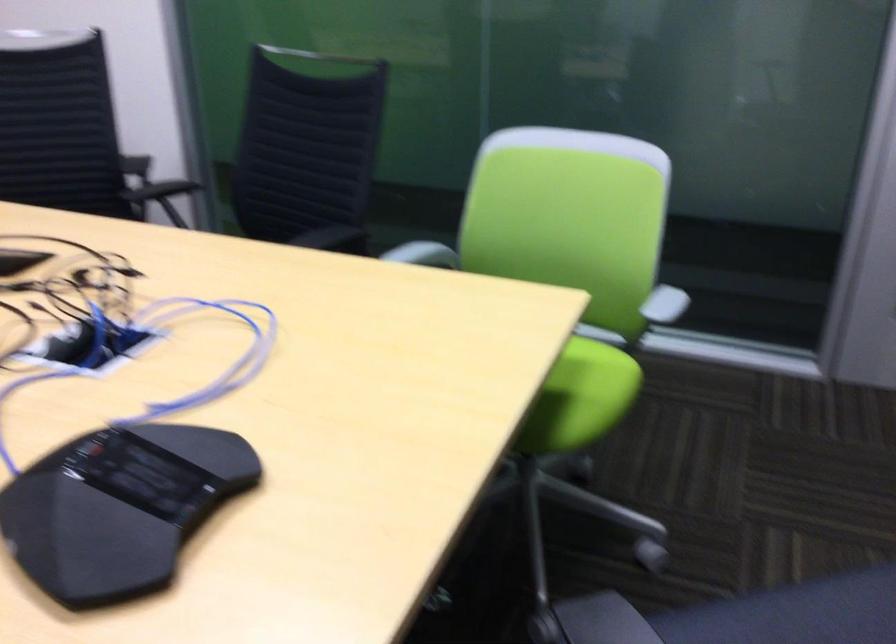
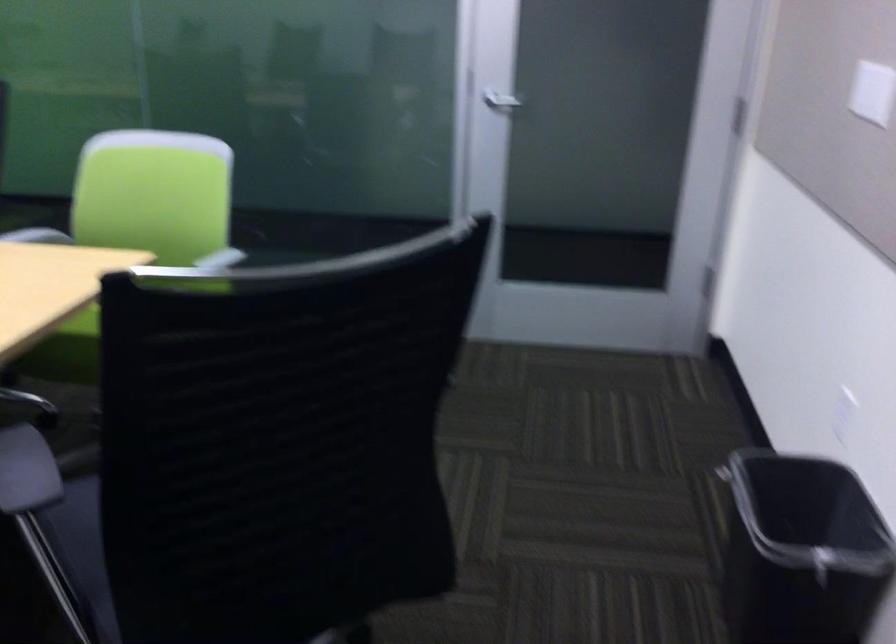
Question: Based on the continuous images, in which direction is the camera rotating? Reply with the corresponding letter.

Choices:
 (A) Left
 (B) Right
 (C) Up
 (D) Down

Answer: (B)